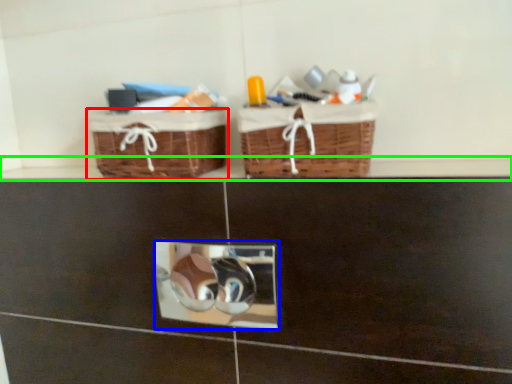
Question: Which object is positioned closest to picnic basket (highlighted by a red box)? Select from mirror (highlighted by a blue box) and ledge (highlighted by a green box).

Choices:
 (A) mirror
 (B) ledge

Answer: (B)